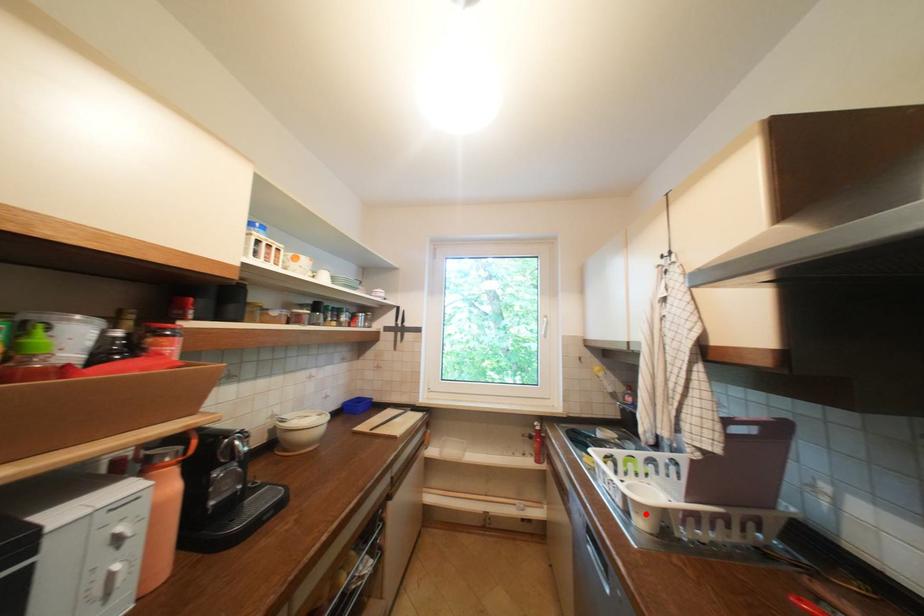
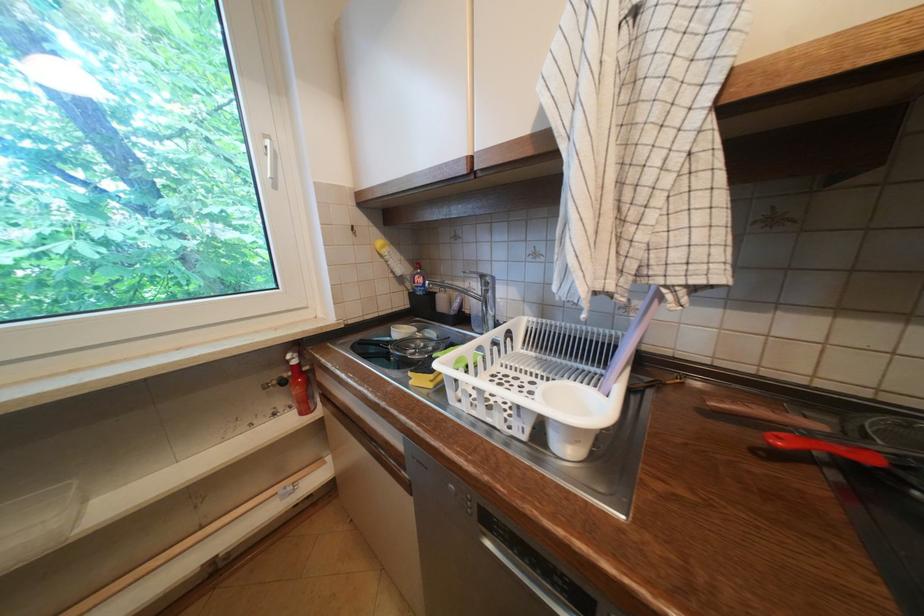
Where in the second image is the point corresponding to the highlighted location from the first image?

(586, 443)